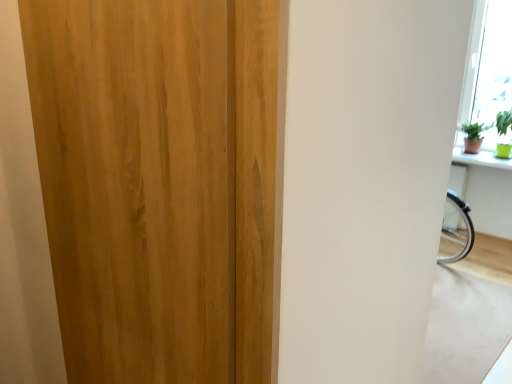
Question: Considering their positions, is green matte window sill at upper right located in front of or behind wooden door at center?

Choices:
 (A) behind
 (B) front

Answer: (A)

Question: Is point (477, 162) positioned closer to the camera than point (45, 188)?

Choices:
 (A) farther
 (B) closer

Answer: (A)

Question: From the image's perspective, is green matte window sill at upper right located above or below wooden door at center?

Choices:
 (A) above
 (B) below

Answer: (A)

Question: Considering the positions of wooden door at center and green matte window sill at upper right in the image, is wooden door at center taller or shorter than green matte window sill at upper right?

Choices:
 (A) tall
 (B) short

Answer: (A)

Question: Is wooden door at center in front of or behind green matte window sill at upper right in the image?

Choices:
 (A) behind
 (B) front

Answer: (B)

Question: In the image, is wooden door at center on the left side or the right side of green matte window sill at upper right?

Choices:
 (A) left
 (B) right

Answer: (A)

Question: Does point (52, 177) appear closer or farther from the camera than point (465, 152)?

Choices:
 (A) farther
 (B) closer

Answer: (B)